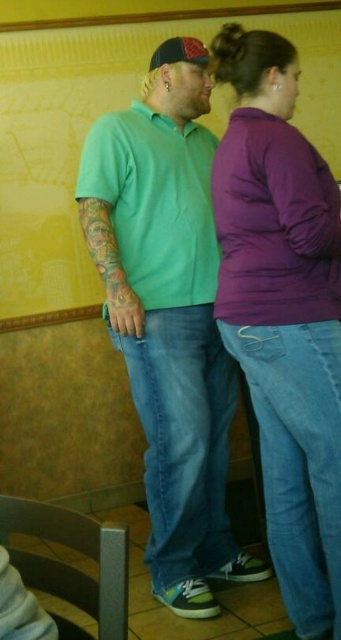
Question: Does green matte shirt at center lie in front of purple fleece at center?

Choices:
 (A) yes
 (B) no

Answer: (B)

Question: Which point is closer to the camera?

Choices:
 (A) matte black baseball cap at upper center
 (B) green matte shirt at center
 (C) purple fleece at center

Answer: (C)

Question: Does green matte shirt at center appear on the left side of purple fleece at center?

Choices:
 (A) no
 (B) yes

Answer: (B)

Question: Estimate the real-world distances between objects in this image. Which object is farther from the green matte shirt at center?

Choices:
 (A) matte black baseball cap at upper center
 (B) purple fleece at center

Answer: (A)

Question: Which point is farther from the camera taking this photo?

Choices:
 (A) (191, 61)
 (B) (137, 304)
 (C) (219, 180)

Answer: (A)

Question: Does green matte shirt at center come behind purple fleece at center?

Choices:
 (A) yes
 (B) no

Answer: (A)